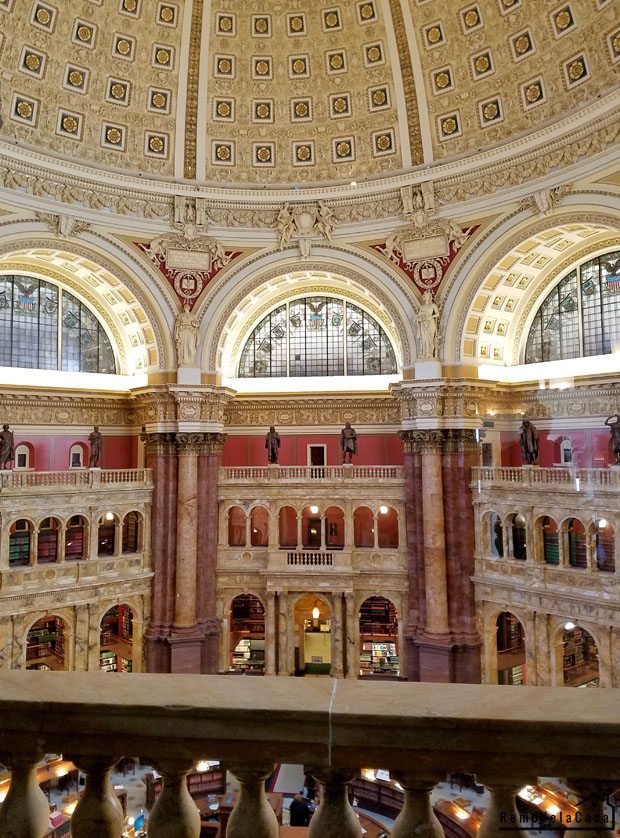
I want to click on floor, so click(361, 485), click(306, 559), click(310, 660).